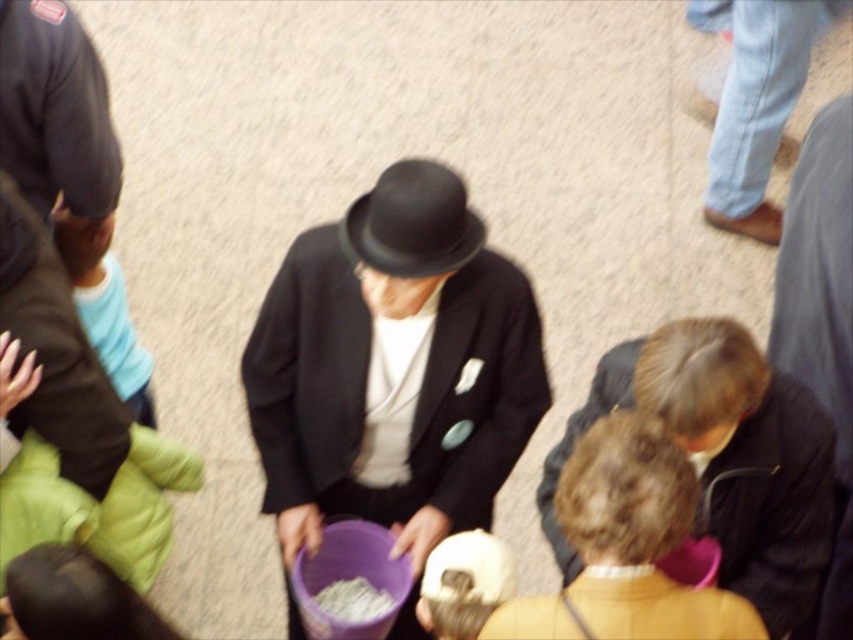
Can you confirm if matte yellow sweater at center is positioned to the left of white crumbly food at center?

No, matte yellow sweater at center is not to the left of white crumbly food at center.

Who is positioned more to the right, matte yellow sweater at center or white crumbly food at center?

matte yellow sweater at center is more to the right.

Is point (666, 449) positioned after point (332, 598)?

No, (666, 449) is closer to viewer.

The width and height of the screenshot is (853, 640). What are the coordinates of `matte yellow sweater at center` in the screenshot? It's located at (625, 547).

Does matte black hat at center come behind black felt hat at center?

Yes, matte black hat at center is further from the viewer.

Is point (338, 410) behind point (364, 198)?

Yes, point (338, 410) is behind point (364, 198).

Image resolution: width=853 pixels, height=640 pixels. I want to click on matte black hat at center, so click(x=393, y=369).

Can you confirm if matte yellow sweater at center is bigger than black felt hat at center?

Indeed, matte yellow sweater at center has a larger size compared to black felt hat at center.

Looking at this image, does matte yellow sweater at center appear on the right side of black felt hat at center?

Indeed, matte yellow sweater at center is positioned on the right side of black felt hat at center.

Which is behind, point (647, 506) or point (381, 204)?

Positioned behind is point (381, 204).

Where is `matte yellow sweater at center`? The image size is (853, 640). matte yellow sweater at center is located at coordinates (625, 547).